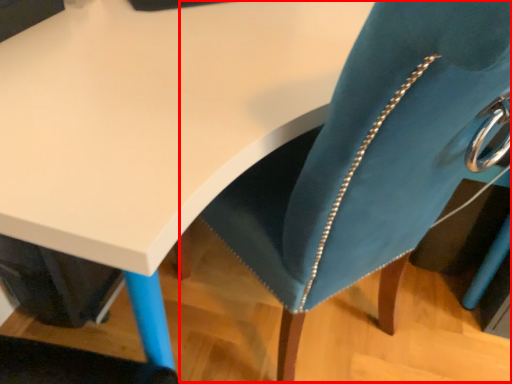
Question: From the image, what is the correct spatial relationship of swivel chair (annotated by the red box) in relation to table?

Choices:
 (A) right
 (B) left

Answer: (A)